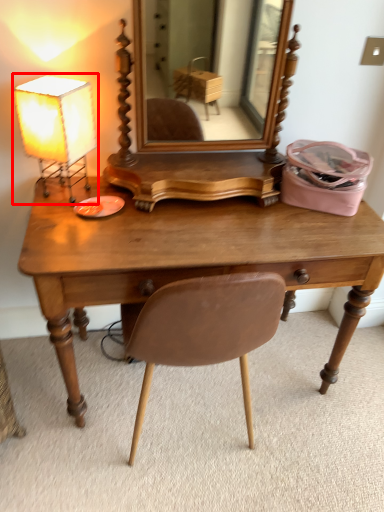
Question: From the image's perspective, where is lamp (annotated by the red box) located relative to desk?

Choices:
 (A) below
 (B) above

Answer: (B)